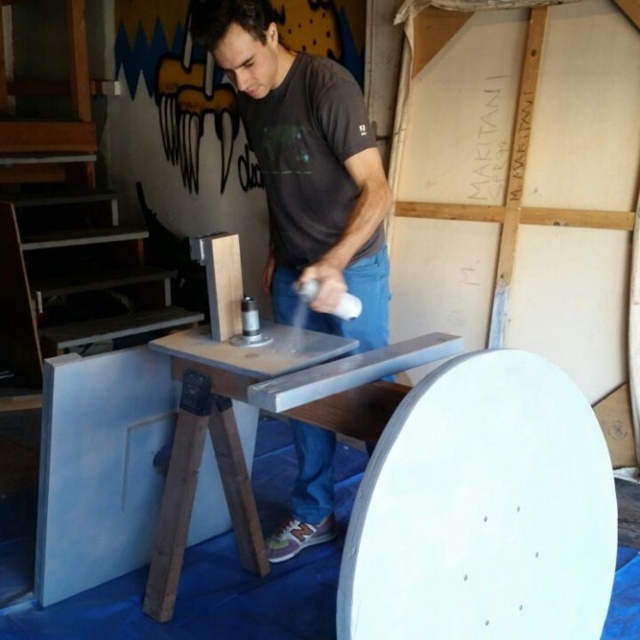
Which is more to the right, matte gray shirt at center or metallic gray workbench at center?

matte gray shirt at center

Is point (321, 157) farther from camera compared to point (269, 344)?

That is True.

Is point (333, 99) farther from viewer compared to point (381, 417)?

Yes, point (333, 99) is behind point (381, 417).

Find the location of a particular element. matte gray shirt at center is located at coordinates (307, 168).